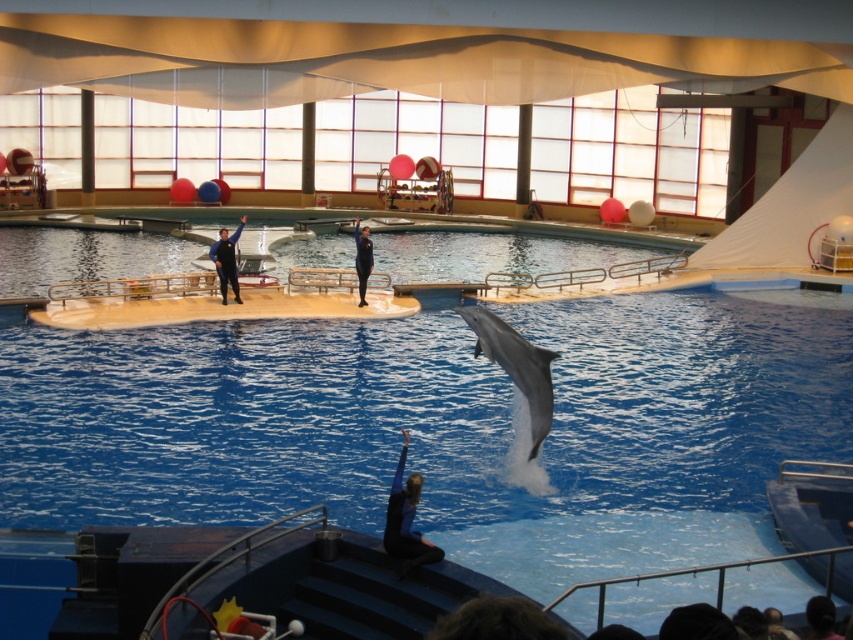
Is gray smooth dolphin at center below blue matte wetsuit at center?

Incorrect, gray smooth dolphin at center is not positioned below blue matte wetsuit at center.

Is point (544, 426) behind point (399, 486)?

Yes.

This screenshot has height=640, width=853. Identify the location of gray smooth dolphin at center. pos(515,365).

Locate an element on the screen. This screenshot has height=640, width=853. gray smooth dolphin at center is located at coordinates (515, 365).

Is gray smooth dolphin at center to the right of black wetsuit at upper center from the viewer's perspective?

Correct, you'll find gray smooth dolphin at center to the right of black wetsuit at upper center.

Which is above, gray smooth dolphin at center or black wetsuit at upper center?

black wetsuit at upper center is above.

This screenshot has width=853, height=640. I want to click on gray smooth dolphin at center, so click(x=515, y=365).

Can you confirm if black wetsuit at upper center is bigger than black rubber wetsuit at center?

No.

Is point (225, 273) in front of point (357, 234)?

Yes, it is in front of point (357, 234).

Based on the photo, who is more forward, (x=229, y=246) or (x=361, y=282)?

Positioned in front is point (x=229, y=246).

At what (x,y) coordinates should I click in order to perform the action: click on black wetsuit at upper center. Please return your answer as a coordinate pair (x, y). Looking at the image, I should click on (225, 260).